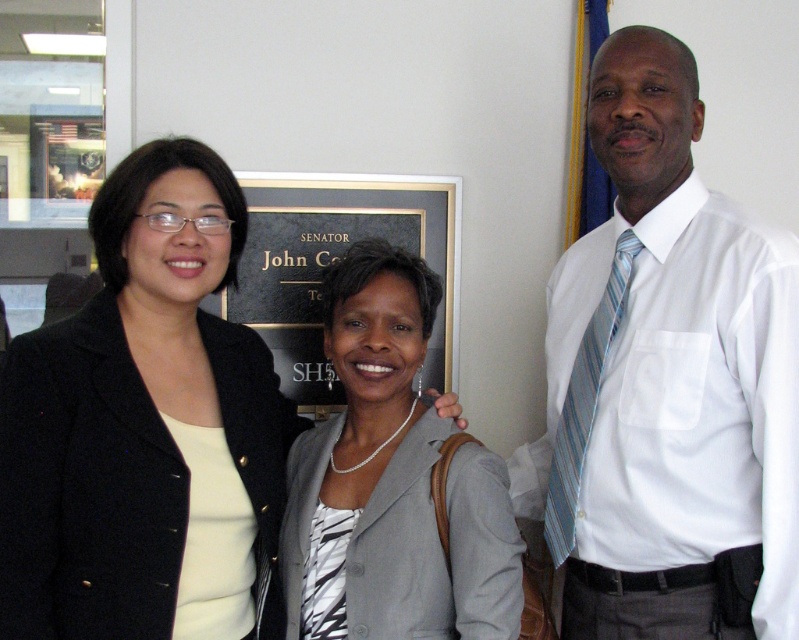
Question: Is matte black blazer at center bigger than gold/black plaque at center?

Choices:
 (A) no
 (B) yes

Answer: (B)

Question: Which point is closer to the camera?

Choices:
 (A) (332, 208)
 (B) (583, 440)
 (C) (404, 442)
 (D) (189, 461)

Answer: (D)

Question: Does white shirt and tie at right appear under gold/black plaque at center?

Choices:
 (A) yes
 (B) no

Answer: (A)

Question: Which of these objects is positioned farthest from the gray fabric jacket at center?

Choices:
 (A) gold/black plaque at center
 (B) white shirt and tie at right
 (C) blue striped tie at right

Answer: (A)

Question: Is gray fabric jacket at center smaller than gold/black plaque at center?

Choices:
 (A) yes
 (B) no

Answer: (B)

Question: Which point is farther to the camera?

Choices:
 (A) blue striped tie at right
 (B) gray fabric jacket at center

Answer: (A)